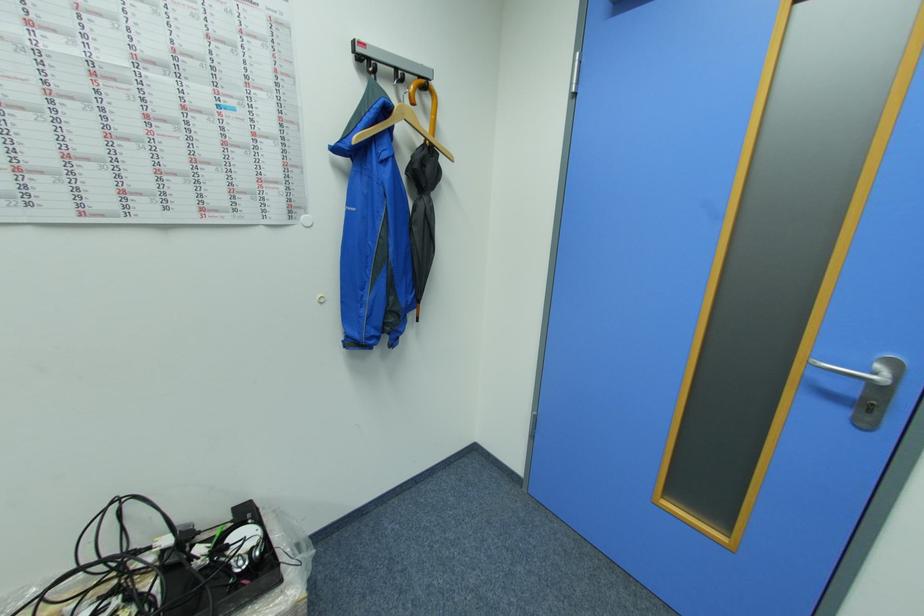
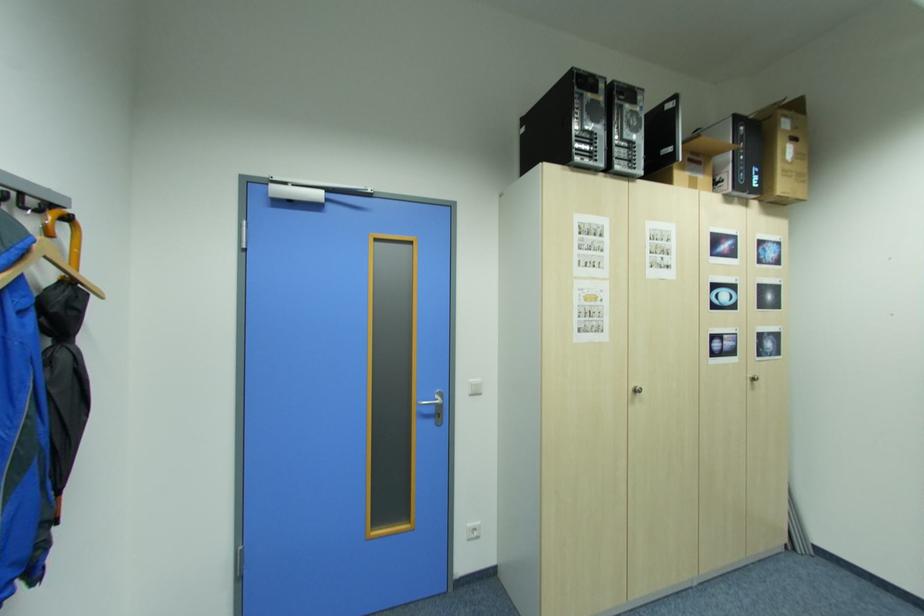
Locate, in the second image, the point that corresponds to [422,167] in the first image.

(64, 310)